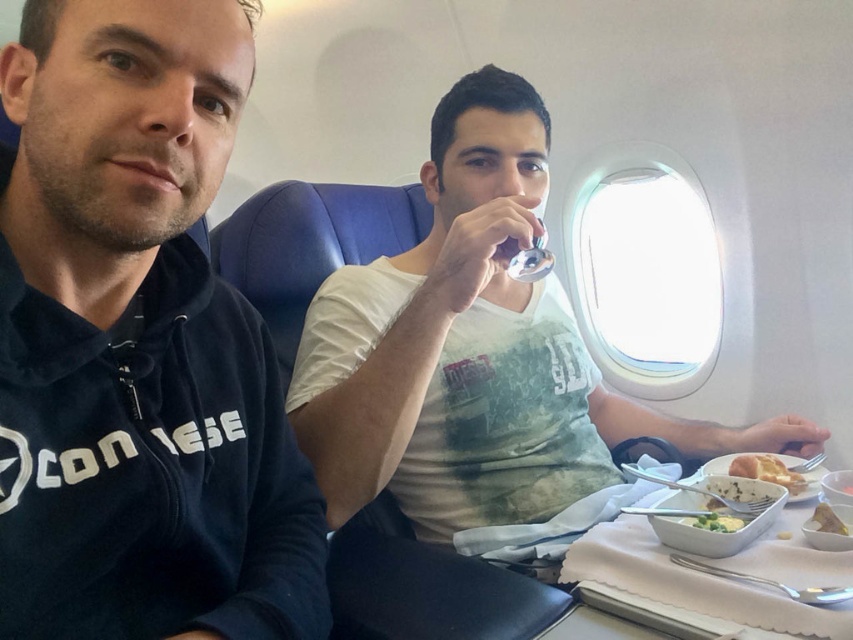
You are a flight attendant observing the white cotton shirt at center and the white matte bread at lower right. Which object is closer to the left side of the airplane cabin?

The white cotton shirt at center is positioned on the left side of white matte bread at lower right, so it is closer to the left side of the airplane cabin.

You are a flight attendant standing at the camera position and need to hand a drink to the person holding the small object near their mouth. The drink is placed at point (x=372, y=483). Can you reach them from your current position?

The distance between the camera and point (x=372, y=483) is 37.05 inches. Since the flight attendant is at the camera position, they can reach the person holding the small object as 37.05 inches is within typical reaching distance for handing a drink.

You are a flight attendant checking the meal cart. You see the white matte food at center and the golden bread at right. Which one is larger?

The golden bread at right is larger than the white matte food at center.